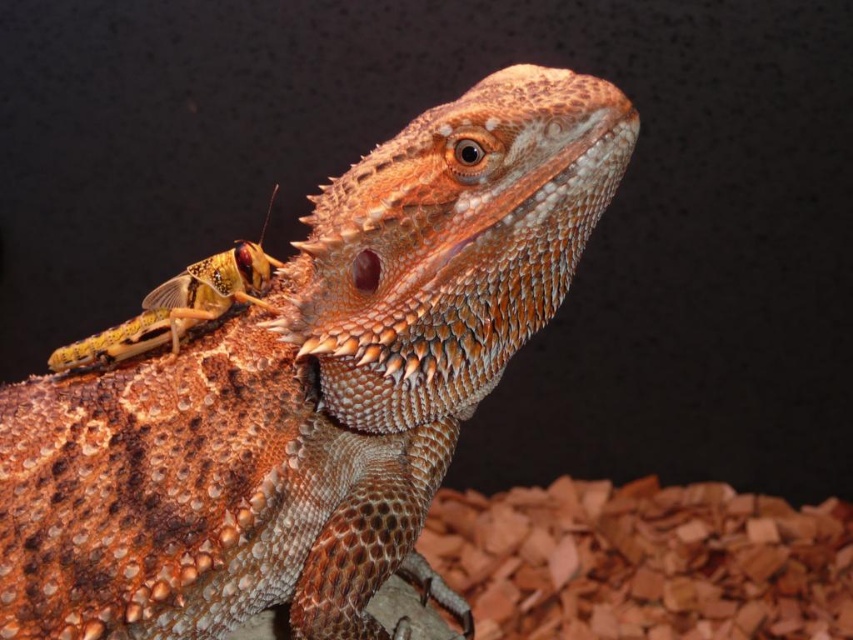
You are a researcher studying the bearded dragon in the image. You need to locate the shiny orange scales at upper center. What are their exact coordinates?

The shiny orange scales at upper center are located at coordinates point (311, 388).